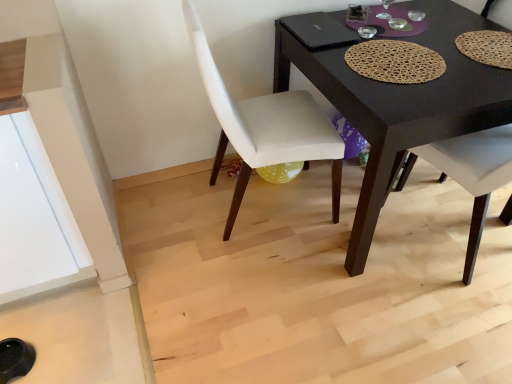
Question: Is brown woven placemat at center situated inside matte woven placemat at upper right, which is counted as the first chair, starting from the right, or outside?

Choices:
 (A) outside
 (B) inside

Answer: (A)

Question: Is brown woven placemat at center bigger or smaller than matte woven placemat at upper right, which is counted as the first chair, starting from the right?

Choices:
 (A) small
 (B) big

Answer: (A)

Question: Which object is the closest to the matte woven placemat at upper right, which is counted as the first chair, starting from the right?

Choices:
 (A) brown woven placemat at center
 (B) white fabric chair at center, the second chair viewed from the right
 (C) black matte desk at center

Answer: (A)

Question: Which object is the farthest from the white fabric chair at center, the second chair viewed from the right?

Choices:
 (A) black matte desk at center
 (B) matte woven placemat at upper right, which is counted as the first chair, starting from the right
 (C) brown woven placemat at center

Answer: (B)